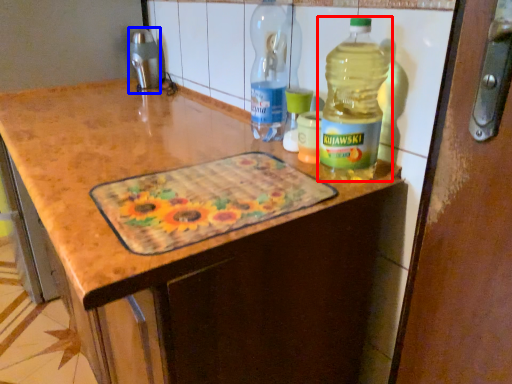
Question: Which object is further to the camera taking this photo, bottle (highlighted by a red box) or appliance (highlighted by a blue box)?

Choices:
 (A) bottle
 (B) appliance

Answer: (B)